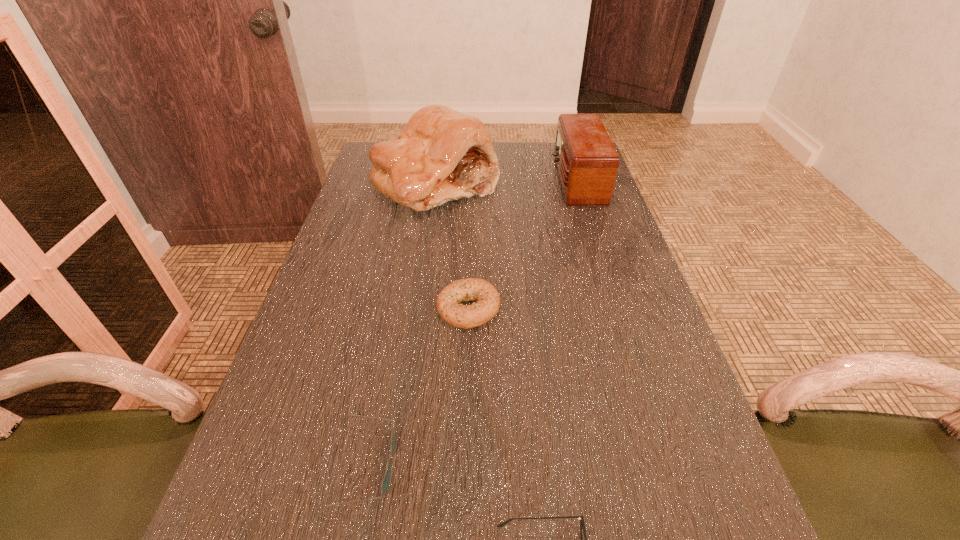
Image resolution: width=960 pixels, height=540 pixels. In order to click on free region at the right edge in this screenshot , I will do `click(566, 249)`.

Where is `empty space that is in between the tallest object and the sunglasses`? empty space that is in between the tallest object and the sunglasses is located at coordinates (399, 325).

Where is `free point between the sunglasses and the bread`? The image size is (960, 540). free point between the sunglasses and the bread is located at coordinates (399, 325).

You are a GUI agent. You are given a task and a screenshot of the screen. Output one action in this format:
    pyautogui.click(x=<x>, y=<y>)
    Task: Click on the vacant region between the tallest object and the third farthest object
    Image resolution: width=960 pixels, height=540 pixels.
    Given the screenshot: What is the action you would take?
    pyautogui.click(x=452, y=246)

Locate an element on the screen. The width and height of the screenshot is (960, 540). free space between the third nearest object and the rightmost object is located at coordinates (522, 245).

Where is `free spot between the bagel and the radio receiver`? The height and width of the screenshot is (540, 960). free spot between the bagel and the radio receiver is located at coordinates (522, 245).

What are the coordinates of `vacant space that is in between the second nearest object and the bagel` in the screenshot? It's located at (416, 387).

The height and width of the screenshot is (540, 960). I want to click on free space between the rightmost object and the bread, so click(x=506, y=182).

Select which object appears as the second closest to the second nearest object. Please provide its 2D coordinates. Your answer should be formatted as a tuple, i.e. [(x, y)], where the tuple contains the x and y coordinates of a point satisfying the conditions above.

[(487, 306)]

Locate an element on the screen. the fourth closest object to the second nearest object is located at coordinates (587, 162).